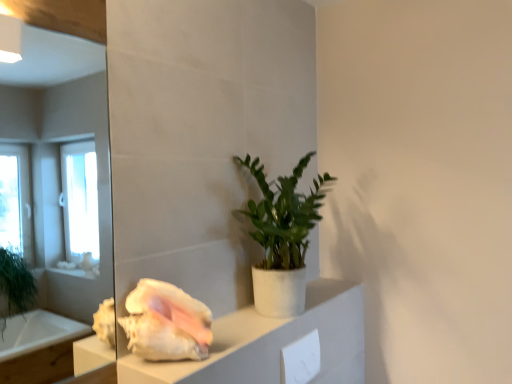
Question: Is green matte plant at center positioned in front of white matte cabinet at center?

Choices:
 (A) yes
 (B) no

Answer: (B)

Question: Does green matte plant at center have a lesser width compared to white matte cabinet at center?

Choices:
 (A) yes
 (B) no

Answer: (B)

Question: Is green matte plant at center bigger than white matte cabinet at center?

Choices:
 (A) yes
 (B) no

Answer: (A)

Question: Considering the relative sizes of green matte plant at center and white matte cabinet at center in the image provided, is green matte plant at center taller than white matte cabinet at center?

Choices:
 (A) yes
 (B) no

Answer: (A)

Question: Does green matte plant at center have a lesser height compared to white matte cabinet at center?

Choices:
 (A) no
 (B) yes

Answer: (A)

Question: In the image, is green matte plant at center on the left side or the right side of white glossy seashell at lower left?

Choices:
 (A) left
 (B) right

Answer: (B)

Question: Would you say green matte plant at center is inside or outside white glossy seashell at lower left?

Choices:
 (A) outside
 (B) inside

Answer: (A)

Question: Is point (259, 307) closer or farther from the camera than point (161, 288)?

Choices:
 (A) farther
 (B) closer

Answer: (A)

Question: Looking at the image, does green matte plant at center seem bigger or smaller compared to white glossy seashell at lower left?

Choices:
 (A) big
 (B) small

Answer: (A)

Question: Is white glossy seashell at lower left inside or outside of green matte plant at center?

Choices:
 (A) inside
 (B) outside

Answer: (B)

Question: Looking at the image, does white glossy seashell at lower left seem bigger or smaller compared to green matte plant at center?

Choices:
 (A) small
 (B) big

Answer: (A)

Question: Is white glossy seashell at lower left taller or shorter than green matte plant at center?

Choices:
 (A) tall
 (B) short

Answer: (B)

Question: From the image's perspective, is white glossy seashell at lower left located above or below green matte plant at center?

Choices:
 (A) below
 (B) above

Answer: (A)

Question: In terms of size, does green matte plant at center appear bigger or smaller than white matte cabinet at center?

Choices:
 (A) small
 (B) big

Answer: (B)

Question: Choose the correct answer: Is green matte plant at center inside white matte cabinet at center or outside it?

Choices:
 (A) outside
 (B) inside

Answer: (A)